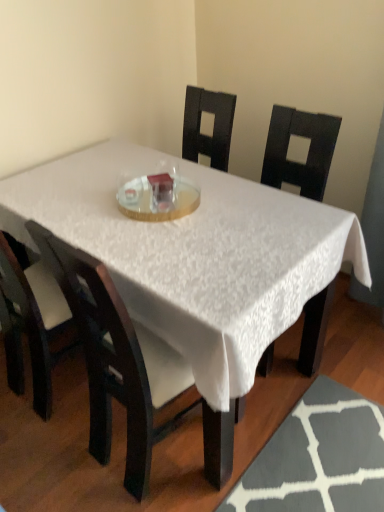
Describe the element at coordinates (30, 321) in the screenshot. I see `matte black chair at center, positioned as the 2th chair in right-to-left order` at that location.

This screenshot has width=384, height=512. Identify the location of matte black chair at center, positioned as the 2th chair in right-to-left order. (30, 321).

From a real-world perspective, relative to matte black chair at center, acting as the 2th chair starting from the left, is clear glass plate at center vertically above or below?

Clearly, from a real-world perspective, clear glass plate at center is above matte black chair at center, acting as the 2th chair starting from the left.

Is clear glass plate at center facing towards matte black chair at center, the first chair when ordered from right to left?

No.

From the picture: From the image's perspective, would you say clear glass plate at center is shown under matte black chair at center, the first chair when ordered from right to left?

No, from the image's perspective, clear glass plate at center is not beneath matte black chair at center, the first chair when ordered from right to left.

Is clear glass plate at center looking in the opposite direction of matte black chair at center, positioned as the 2th chair in right-to-left order?

That's not correct — clear glass plate at center is not looking away from matte black chair at center, positioned as the 2th chair in right-to-left order.

From a real-world perspective, which is physically below, clear glass plate at center or matte black chair at center, which is the 1th chair from left to right?

matte black chair at center, which is the 1th chair from left to right, is physically lower.

Is point (125, 200) positioned after point (46, 357)?

No, it is not.

Which object is positioned more to the left, clear glass plate at center or matte black chair at center, positioned as the 2th chair in right-to-left order?

From the viewer's perspective, matte black chair at center, positioned as the 2th chair in right-to-left order, appears more on the left side.

From the picture: Are matte black chair at center, acting as the 2th chair starting from the left, and clear glass plate at center making contact?

No, matte black chair at center, acting as the 2th chair starting from the left, is not in contact with clear glass plate at center.

Would you say matte black chair at center, the first chair when ordered from right to left, contains clear glass plate at center?

Actually, clear glass plate at center is outside matte black chair at center, the first chair when ordered from right to left.

Is matte black chair at center, acting as the 2th chair starting from the left, taller or shorter than clear glass plate at center?

Considering their sizes, matte black chair at center, acting as the 2th chair starting from the left, has more height than clear glass plate at center.

Consider the image. Considering the sizes of objects matte black chair at center, the first chair when ordered from right to left, and clear glass plate at center in the image provided, who is smaller, matte black chair at center, the first chair when ordered from right to left, or clear glass plate at center?

With smaller size is clear glass plate at center.

Considering the relative positions of matte black chair at center, positioned as the 2th chair in right-to-left order, and matte black chair at center, acting as the 2th chair starting from the left, in the image provided, is matte black chair at center, positioned as the 2th chair in right-to-left order, to the left of matte black chair at center, acting as the 2th chair starting from the left, from the viewer's perspective?

Indeed, matte black chair at center, positioned as the 2th chair in right-to-left order, is positioned on the left side of matte black chair at center, acting as the 2th chair starting from the left.

From a real-world perspective, which is physically below, matte black chair at center, which is the 1th chair from left to right, or matte black chair at center, acting as the 2th chair starting from the left?

matte black chair at center, acting as the 2th chair starting from the left.

Can you confirm if matte black chair at center, positioned as the 2th chair in right-to-left order, is wider than matte black chair at center, acting as the 2th chair starting from the left?

No.

In the scene shown: Is matte black chair at center, acting as the 2th chair starting from the left, positioned far away from matte black chair at center, positioned as the 2th chair in right-to-left order?

No, there isn't a large distance between matte black chair at center, acting as the 2th chair starting from the left, and matte black chair at center, positioned as the 2th chair in right-to-left order.

In order to click on chair that appears on the right of matte black chair at center, which is the 1th chair from left to right in this screenshot , I will do `click(124, 371)`.

In the image, is matte black chair at center, acting as the 2th chair starting from the left, positioned in front of or behind matte black chair at center, positioned as the 2th chair in right-to-left order?

matte black chair at center, acting as the 2th chair starting from the left, is in front of matte black chair at center, positioned as the 2th chair in right-to-left order.

Is matte black chair at center, the first chair when ordered from right to left, looking in the opposite direction of matte black chair at center, positioned as the 2th chair in right-to-left order?

matte black chair at center, the first chair when ordered from right to left, does not have its back to matte black chair at center, positioned as the 2th chair in right-to-left order.

Which object is positioned more to the right, matte black chair at center, which is the 1th chair from left to right, or white textured table at center?

From the viewer's perspective, white textured table at center appears more on the right side.

Which is behind, point (50, 303) or point (288, 318)?

The point (50, 303) is farther from the camera.

Is matte black chair at center, positioned as the 2th chair in right-to-left order, positioned far away from white textured table at center?

matte black chair at center, positioned as the 2th chair in right-to-left order, is near white textured table at center, not far away.

Considering the positions of objects matte black chair at center, which is the 1th chair from left to right, and white textured table at center in the image provided, who is in front, matte black chair at center, which is the 1th chair from left to right, or white textured table at center?

white textured table at center is closer to the camera.

Considering the sizes of objects white textured table at center and clear glass plate at center in the image provided, who is smaller, white textured table at center or clear glass plate at center?

clear glass plate at center.

Is clear glass plate at center a part of white textured table at center?

Yes, clear glass plate at center is inside white textured table at center.

From a real-world perspective, between white textured table at center and clear glass plate at center, who is vertically lower?

white textured table at center, from a real-world perspective.

Is white textured table at center looking in the opposite direction of clear glass plate at center?

That's not correct — white textured table at center is not looking away from clear glass plate at center.

You are a GUI agent. You are given a task and a screenshot of the screen. Output one action in this format:
    pyautogui.click(x=<x>, y=<y>)
    Task: Click on the 1st chair counting from the left side of the clear glass plate at center
    The height and width of the screenshot is (512, 384).
    Given the screenshot: What is the action you would take?
    pyautogui.click(x=124, y=371)

Identify the location of the 1st chair below when counting from the clear glass plate at center (from the image's perspective). The width and height of the screenshot is (384, 512). (30, 321).

Considering their positions, is white textured table at center positioned further to matte black chair at center, the first chair when ordered from right to left, than matte black chair at center, positioned as the 2th chair in right-to-left order?

matte black chair at center, positioned as the 2th chair in right-to-left order, lies further to matte black chair at center, the first chair when ordered from right to left, than the other object.

From the image, which object appears to be farther from white textured table at center, matte black chair at center, acting as the 2th chair starting from the left, or matte black chair at center, positioned as the 2th chair in right-to-left order?

matte black chair at center, positioned as the 2th chair in right-to-left order, is positioned further to the anchor white textured table at center.

Estimate the real-world distances between objects in this image. Which object is further from white textured table at center, matte black chair at center, acting as the 2th chair starting from the left, or clear glass plate at center?

matte black chair at center, acting as the 2th chair starting from the left, is further to white textured table at center.

Which object lies nearer to the anchor point clear glass plate at center, matte black chair at center, positioned as the 2th chair in right-to-left order, or matte black chair at center, acting as the 2th chair starting from the left?

Among the two, matte black chair at center, acting as the 2th chair starting from the left, is located nearer to clear glass plate at center.

Considering their positions, is white textured table at center positioned closer to clear glass plate at center than matte black chair at center, acting as the 2th chair starting from the left?

white textured table at center is positioned closer to the anchor clear glass plate at center.

Based on their spatial positions, is clear glass plate at center or matte black chair at center, acting as the 2th chair starting from the left, further from white textured table at center?

Based on the image, matte black chair at center, acting as the 2th chair starting from the left, appears to be further to white textured table at center.

Estimate the real-world distances between objects in this image. Which object is further from clear glass plate at center, white textured table at center or matte black chair at center, positioned as the 2th chair in right-to-left order?

matte black chair at center, positioned as the 2th chair in right-to-left order, lies further to clear glass plate at center than the other object.

When comparing their distances from white textured table at center, does clear glass plate at center or matte black chair at center, positioned as the 2th chair in right-to-left order, seem further?

The object further to white textured table at center is matte black chair at center, positioned as the 2th chair in right-to-left order.

Locate an element on the screen. The image size is (384, 512). chair between matte black chair at center, the first chair when ordered from right to left, and clear glass plate at center from front to back is located at coordinates (30, 321).

Locate an element on the screen. This screenshot has height=512, width=384. table between matte black chair at center, acting as the 2th chair starting from the left, and clear glass plate at center from front to back is located at coordinates (194, 255).

Locate an element on the screen. glass plate between matte black chair at center, which is the 1th chair from left to right, and white textured table at center is located at coordinates 158,198.

Locate an element on the screen. chair between matte black chair at center, which is the 1th chair from left to right, and white textured table at center is located at coordinates (124, 371).